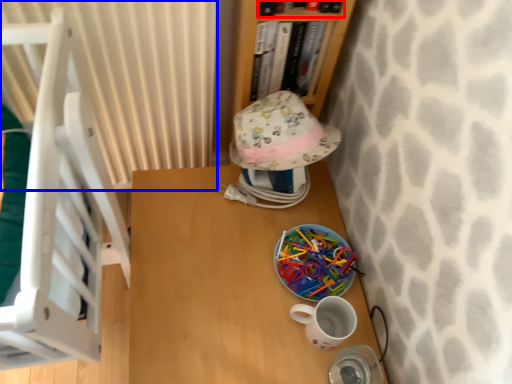
Question: Which object appears farthest to the camera in this image, book (highlighted by a red box) or curtain (highlighted by a blue box)?

Choices:
 (A) book
 (B) curtain

Answer: (B)